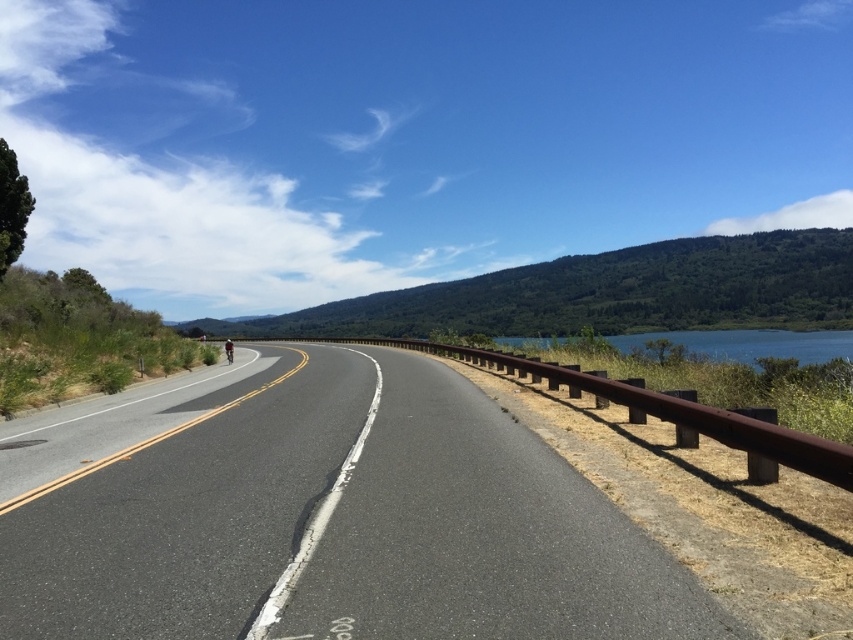
You are a drone operator planning to capture aerial footage of the asphalt road at center and the blue water at upper right. Which object would require a wider camera frame to fully capture in the image?

The blue water at upper right would require a wider camera frame since it is larger than the asphalt road at center.

In the scene shown: You are a drone operator trying to capture a photo of the asphalt road at center and the blue water at upper right. Which object will appear larger in the photo?

The asphalt road at center will appear larger in the photo because it is closer to the viewer than the blue water at upper right.

You are driving a car and see two points on the road ahead. The first point is at coordinate point(663, 552) and the second is at point(680, 342). According to the scene, which point is closer to your current position?

Point(680, 342) is closer to your current position because it is behind point(663, 552), which is further ahead on the road.